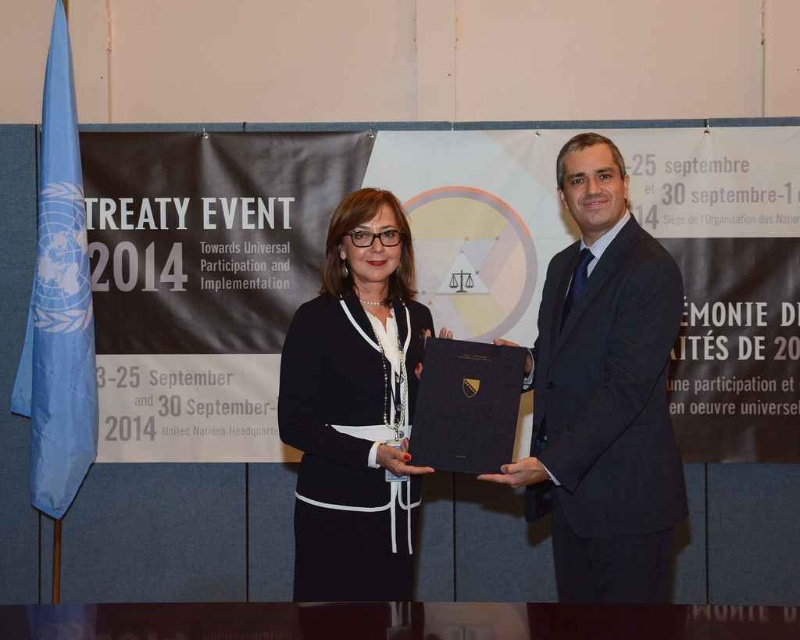
Between black suit at right and black matte jacket at center, which one appears on the left side from the viewer's perspective?

black matte jacket at center

Does black suit at right come behind black matte jacket at center?

No, it is in front of black matte jacket at center.

Which is behind, point (674, 444) or point (389, 337)?

Positioned behind is point (389, 337).

Find the location of a particular element. The height and width of the screenshot is (640, 800). black suit at right is located at coordinates (604, 394).